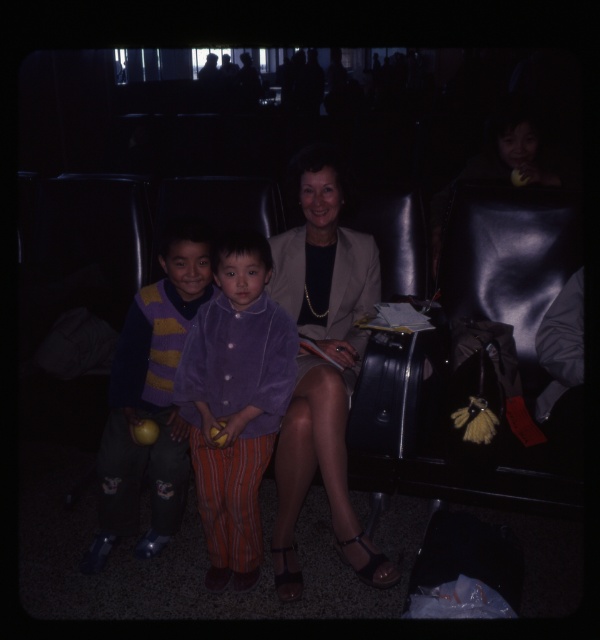
Between point (319, 404) and point (223, 364), which one is positioned in front?

Positioned in front is point (319, 404).

Locate an element on the screen. This screenshot has height=640, width=600. matte beige blazer at center is located at coordinates (322, 364).

Who is shorter, matte beige blazer at center or striped sweater at center?

Standing shorter between the two is striped sweater at center.

Find the location of a particular element. matte beige blazer at center is located at coordinates (322, 364).

Who is more forward, (x=327, y=212) or (x=122, y=522)?

Point (x=327, y=212)

Image resolution: width=600 pixels, height=640 pixels. I want to click on matte beige blazer at center, so click(322, 364).

Is purple fleece jacket at center positioned before striped sweater at center?

Yes, it is in front of striped sweater at center.

Does point (259, 541) lie in front of point (160, 253)?

Yes.

Find the location of `purple fleece jacket at center`. purple fleece jacket at center is located at coordinates (235, 403).